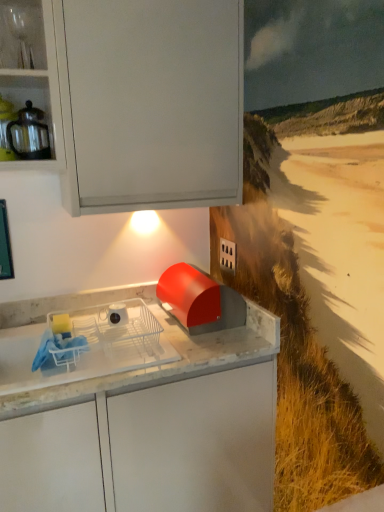
Question: Considering the relative positions of white plastic dish rack at center and white glossy mug at center in the image provided, is white plastic dish rack at center to the left or to the right of white glossy mug at center?

Choices:
 (A) right
 (B) left

Answer: (B)

Question: From the image's perspective, relative to white glossy mug at center, is white plastic dish rack at center above or below?

Choices:
 (A) above
 (B) below

Answer: (B)

Question: Considering the real-world distances, which object is farthest from the clear glassware at upper left?

Choices:
 (A) matte glass teapot at upper left
 (B) white plastic dish rack at center
 (C) white glossy mug at center

Answer: (B)

Question: Estimate the real-world distances between objects in this image. Which object is farther from the white glossy mug at center?

Choices:
 (A) matte glass teapot at upper left
 (B) clear glassware at upper left
 (C) white plastic dish rack at center

Answer: (B)